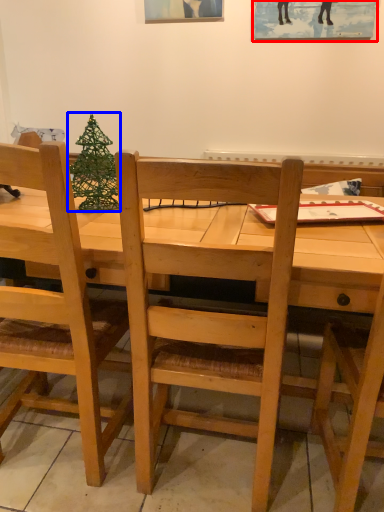
Question: Which point is further to the camera, picture frame (highlighted by a red box) or christmas tree (highlighted by a blue box)?

Choices:
 (A) picture frame
 (B) christmas tree

Answer: (A)